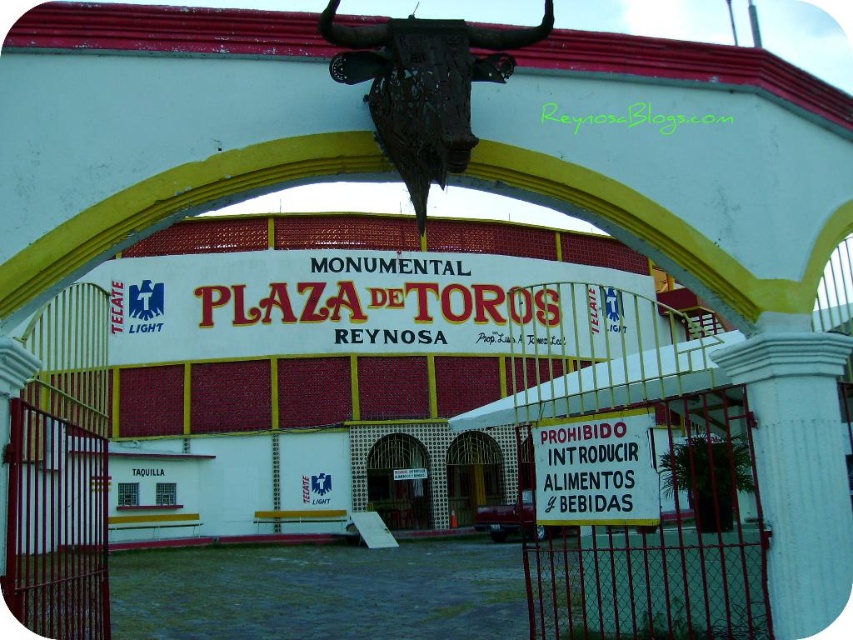
Can you confirm if white paper sign at center is thinner than metallic gate at center?

Yes, white paper sign at center is thinner than metallic gate at center.

Can you confirm if white paper sign at center is positioned to the right of metallic gate at center?

Correct, you'll find white paper sign at center to the right of metallic gate at center.

The height and width of the screenshot is (640, 853). Find the location of `white paper sign at center`. white paper sign at center is located at coordinates (595, 470).

The image size is (853, 640). Describe the element at coordinates (422, 86) in the screenshot. I see `rusty metal bull head at center` at that location.

Is point (422, 148) closer to viewer compared to point (445, 452)?

That is True.

The height and width of the screenshot is (640, 853). What are the coordinates of `rusty metal bull head at center` in the screenshot? It's located at (422, 86).

Which of these two, rusty metal bull head at center or white paper sign at center, stands taller?

Standing taller between the two is rusty metal bull head at center.

Is rusty metal bull head at center further to the viewer compared to white paper sign at center?

No.

Identify the location of rusty metal bull head at center. (422, 86).

In order to click on rusty metal bull head at center in this screenshot , I will do `click(422, 86)`.